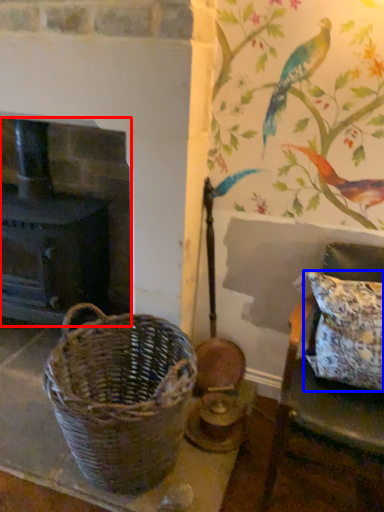
Question: Among these objects, which one is nearest to the camera, fireplace (highlighted by a red box) or pillow (highlighted by a blue box)?

Choices:
 (A) fireplace
 (B) pillow

Answer: (B)